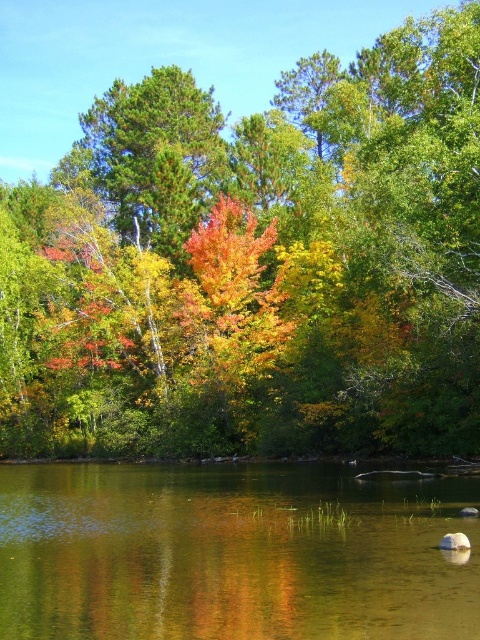
Question: Is autumn leaves at center above clear water at center?

Choices:
 (A) yes
 (B) no

Answer: (A)

Question: Which point appears closest to the camera in this image?

Choices:
 (A) (210, 568)
 (B) (228, 324)

Answer: (A)

Question: Is autumn leaves at center below clear water at center?

Choices:
 (A) no
 (B) yes

Answer: (A)

Question: Does autumn leaves at center appear on the left side of clear water at center?

Choices:
 (A) yes
 (B) no

Answer: (A)

Question: Which point is closer to the camera taking this photo?

Choices:
 (A) (360, 636)
 (B) (122, 307)

Answer: (A)